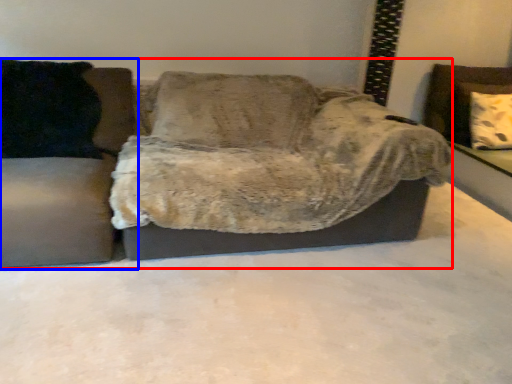
Question: Which object appears closest to the camera in this image, studio couch (highlighted by a red box) or studio couch (highlighted by a blue box)?

Choices:
 (A) studio couch
 (B) studio couch

Answer: (B)